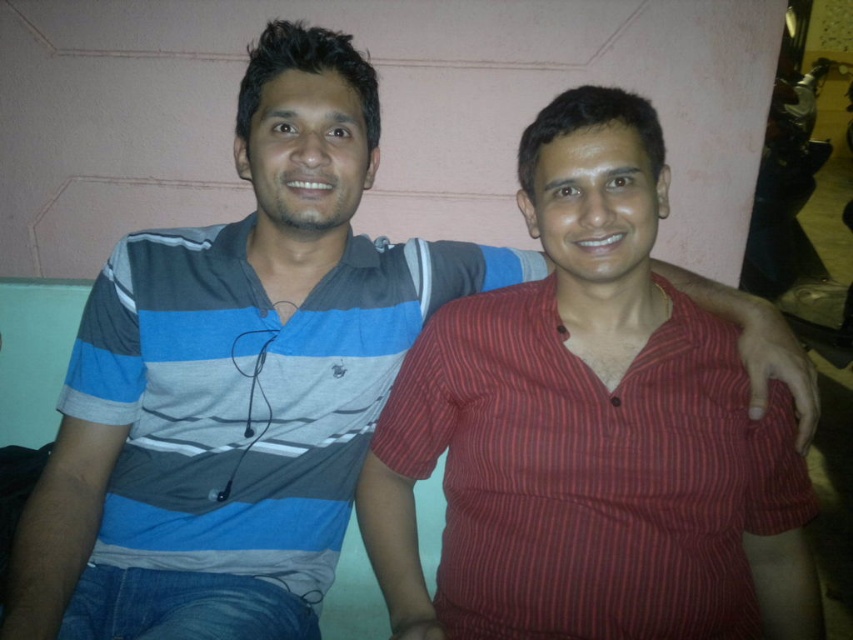
You are organizing a clothing donation drive and need to sort shirts by size. You have a red striped shirt at center and a striped cotton shirt at left. Which shirt should you place in the small size bin?

The red striped shirt at center is smaller than the striped cotton shirt at left, so it should be placed in the small size bin.

You are standing in the room and want to locate the red striped shirt at center. According to the coordinates provided, where should you look relative to the center of the image?

The red striped shirt at center is located at coordinates point (x=590, y=474), which is slightly to the right and above the center of the image.